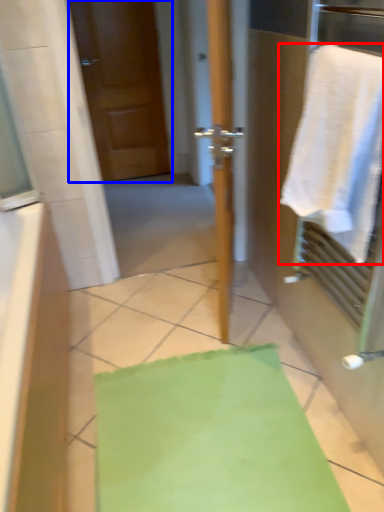
Question: Which object appears closest to the camera in this image, towel (highlighted by a red box) or door (highlighted by a blue box)?

Choices:
 (A) towel
 (B) door

Answer: (A)